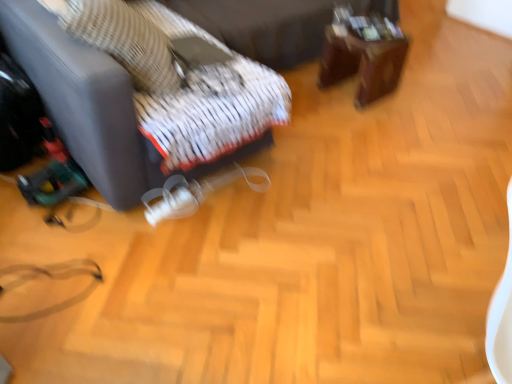
Where is `vacant region in front of brown wooden table at upper right`? This screenshot has height=384, width=512. vacant region in front of brown wooden table at upper right is located at coordinates (360, 123).